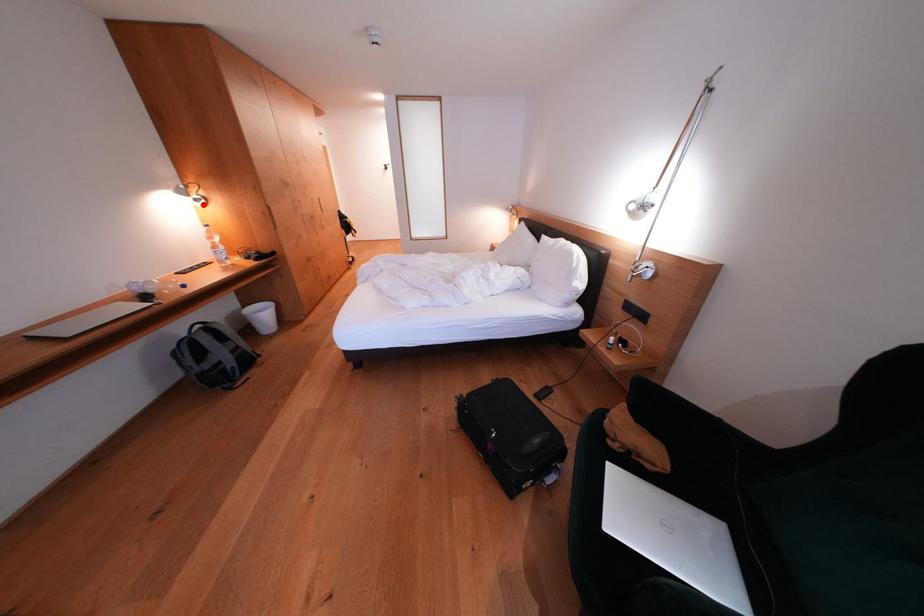
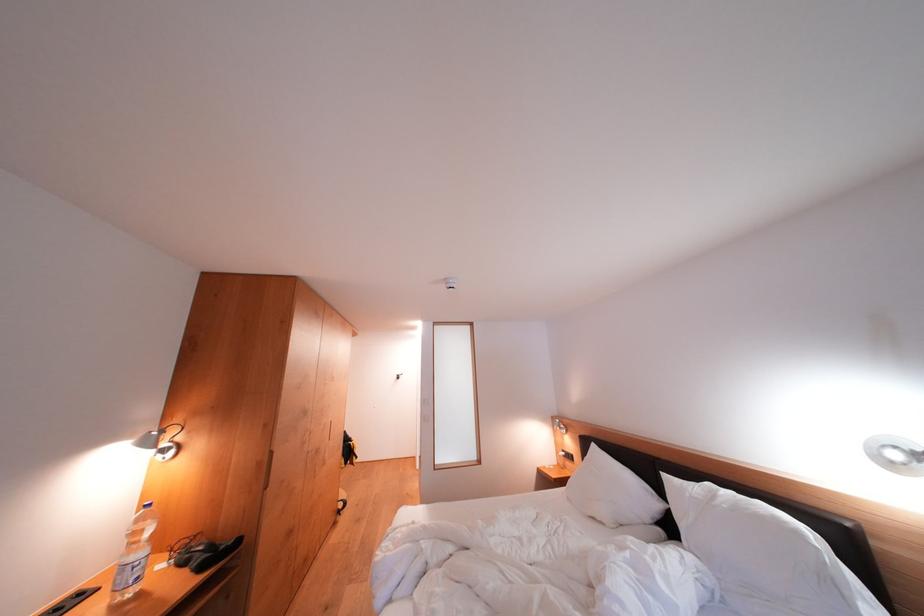
The point at the highlighted location is marked in the first image. Where is the corresponding point in the second image?

(169, 455)